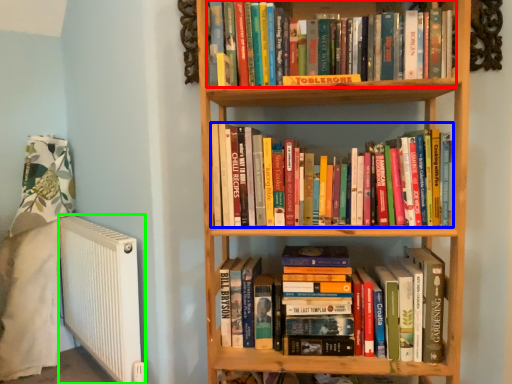
Question: Considering the real-world distances, which object is closest to book (highlighted by a red box)? book (highlighted by a blue box) or radiator (highlighted by a green box).

Choices:
 (A) book
 (B) radiator

Answer: (A)